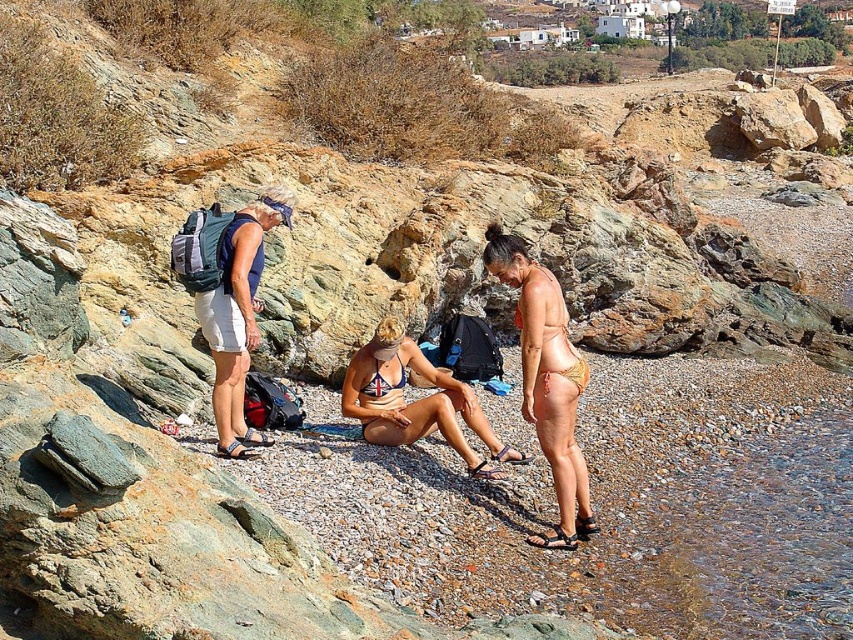
Question: Is matte blue tank top at center wider than blue printed bikini top at center?

Choices:
 (A) no
 (B) yes

Answer: (B)

Question: Among these points, which one is nearest to the camera?

Choices:
 (A) (201, 300)
 (B) (381, 376)

Answer: (A)

Question: Among these objects, which one is nearest to the camera?

Choices:
 (A) matte blue tank top at center
 (B) blue bikini at center

Answer: (A)

Question: Does matte blue tank top at center lie behind blue printed bikini top at center?

Choices:
 (A) no
 (B) yes

Answer: (A)

Question: Estimate the real-world distances between objects in this image. Which object is closer to the blue printed bikini top at center?

Choices:
 (A) blue bikini at center
 (B) matte blue tank top at center

Answer: (A)

Question: Observing the image, what is the correct spatial positioning of tan bikini at center in reference to blue bikini at center?

Choices:
 (A) right
 (B) left

Answer: (A)